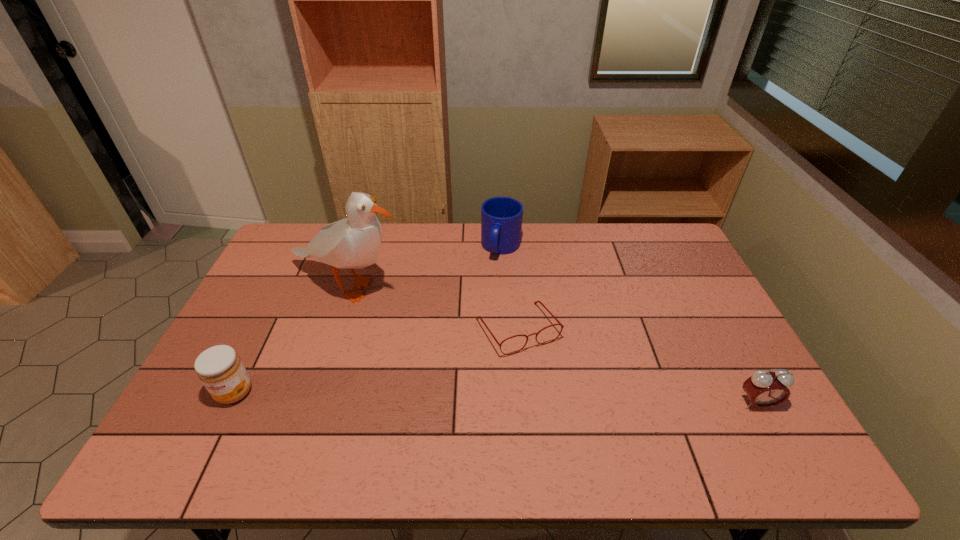
Find the location of a particular element. The image size is (960, 540). jam is located at coordinates (220, 369).

Locate an element on the screen. The image size is (960, 540). the rightmost object is located at coordinates (765, 389).

At what (x,y) coordinates should I click in order to perform the action: click on mug. Please return your answer as a coordinate pair (x, y). Image resolution: width=960 pixels, height=540 pixels. Looking at the image, I should click on (501, 217).

The height and width of the screenshot is (540, 960). I want to click on spectacles, so click(x=541, y=303).

You are a GUI agent. You are given a task and a screenshot of the screen. Output one action in this format:
    pyautogui.click(x=<x>, y=<y>)
    Task: Click on the tallest object
    This screenshot has height=540, width=960.
    Given the screenshot: What is the action you would take?
    pyautogui.click(x=352, y=243)

Identify the location of vacant position located on the side with the handle of the mug. (471, 330).

Locate an element on the screen. vacant space situated 0.090m on the side with the handle of the mug is located at coordinates (491, 281).

Where is `free space located 0.210m on the side with the handle of the mug`? The height and width of the screenshot is (540, 960). free space located 0.210m on the side with the handle of the mug is located at coordinates (481, 307).

Find the location of `free spot located 0.150m on the face of the shortest object`. free spot located 0.150m on the face of the shortest object is located at coordinates (564, 402).

Find the location of a particular element. vacant space located 0.130m on the face of the shortest object is located at coordinates (560, 396).